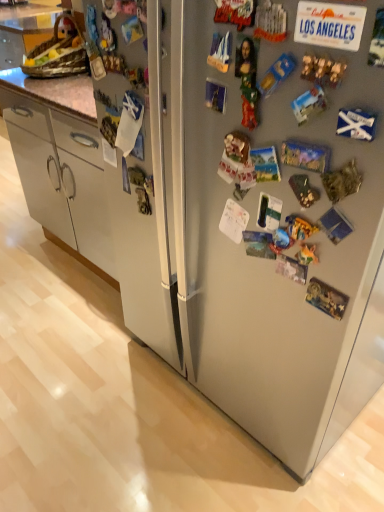
Image resolution: width=384 pixels, height=512 pixels. What do you see at coordinates (254, 205) in the screenshot?
I see `satin silver refrigerator at center` at bounding box center [254, 205].

At what (x,y) coordinates should I click in order to perform the action: click on satin silver refrigerator at center. Please return your answer as a coordinate pair (x, y). This screenshot has height=512, width=384. Looking at the image, I should click on (254, 205).

What do you see at coordinates (43, 67) in the screenshot? I see `wooden basket at upper left` at bounding box center [43, 67].

Find the location of a particular element. The width and height of the screenshot is (384, 512). wooden basket at upper left is located at coordinates (43, 67).

At what (x,y) coordinates should I click in order to perform the action: click on satin silver refrigerator at center. Please return your answer as a coordinate pair (x, y). Looking at the image, I should click on (254, 205).

Considering the relative positions of satin silver refrigerator at center and wooden basket at upper left in the image provided, is satin silver refrigerator at center to the right of wooden basket at upper left from the viewer's perspective?

No, satin silver refrigerator at center is not to the right of wooden basket at upper left.

Is the depth of satin silver refrigerator at center greater than that of wooden basket at upper left?

No, it is in front of wooden basket at upper left.

Which is farther, (186, 319) or (63, 82)?

The point (63, 82) is farther from the camera.

From the image's perspective, is satin silver refrigerator at center beneath wooden basket at upper left?

Yes, from the image's perspective, satin silver refrigerator at center is below wooden basket at upper left.

From a real-world perspective, between satin silver refrigerator at center and wooden basket at upper left, who is vertically lower?

From a 3D spatial view, satin silver refrigerator at center is below.

Does satin silver refrigerator at center have a lesser width compared to wooden basket at upper left?

No, satin silver refrigerator at center is not thinner than wooden basket at upper left.

From their relative heights in the image, would you say satin silver refrigerator at center is taller or shorter than wooden basket at upper left?

In the image, satin silver refrigerator at center appears to be shorter than wooden basket at upper left.

Between satin silver refrigerator at center and wooden basket at upper left, which one has larger size?

satin silver refrigerator at center is bigger.

Is satin silver refrigerator at center situated inside wooden basket at upper left or outside?

satin silver refrigerator at center cannot be found inside wooden basket at upper left.

Is satin silver refrigerator at center touching wooden basket at upper left?

No.

Is satin silver refrigerator at center oriented away from wooden basket at upper left?

No.

Can you tell me how much satin silver refrigerator at center and wooden basket at upper left differ in facing direction?

satin silver refrigerator at center and wooden basket at upper left are facing 87.1 degrees away from each other.

This screenshot has height=512, width=384. I want to click on counter top above the satin silver refrigerator at center (from a real-world perspective), so click(43, 67).

Is wooden basket at upper left at the left side of satin silver refrigerator at center?

No.

Which object is further away from the camera, wooden basket at upper left or satin silver refrigerator at center?

wooden basket at upper left is more distant.

Does point (13, 20) appear closer or farther from the camera than point (293, 207)?

Point (13, 20) is positioned farther from the camera compared to point (293, 207).

From the image's perspective, would you say wooden basket at upper left is positioned over satin silver refrigerator at center?

Yes, from the image's perspective, wooden basket at upper left is on top of satin silver refrigerator at center.

From a real-world perspective, does wooden basket at upper left sit lower than satin silver refrigerator at center?

Incorrect, from a real-world perspective, wooden basket at upper left is higher than satin silver refrigerator at center.

Considering the relative sizes of wooden basket at upper left and satin silver refrigerator at center in the image provided, is wooden basket at upper left wider than satin silver refrigerator at center?

No.

Is wooden basket at upper left taller or shorter than satin silver refrigerator at center?

wooden basket at upper left is taller than satin silver refrigerator at center.

Does wooden basket at upper left have a larger size compared to satin silver refrigerator at center?

Actually, wooden basket at upper left might be smaller than satin silver refrigerator at center.

Is wooden basket at upper left surrounding satin silver refrigerator at center?

No, satin silver refrigerator at center is not a part of wooden basket at upper left.

Is wooden basket at upper left far from satin silver refrigerator at center?

wooden basket at upper left is actually quite close to satin silver refrigerator at center.

Based on the photo, is wooden basket at upper left facing towards satin silver refrigerator at center?

No, wooden basket at upper left does not turn towards satin silver refrigerator at center.

There is a satin silver refrigerator at center. Where is `counter top above it (from a real-world perspective)`? The width and height of the screenshot is (384, 512). counter top above it (from a real-world perspective) is located at coordinates (43, 67).

Locate an element on the screen. The image size is (384, 512). refrigerator located on the left of wooden basket at upper left is located at coordinates (254, 205).

This screenshot has height=512, width=384. Find the location of `counter top located behind the satin silver refrigerator at center`. counter top located behind the satin silver refrigerator at center is located at coordinates (43, 67).